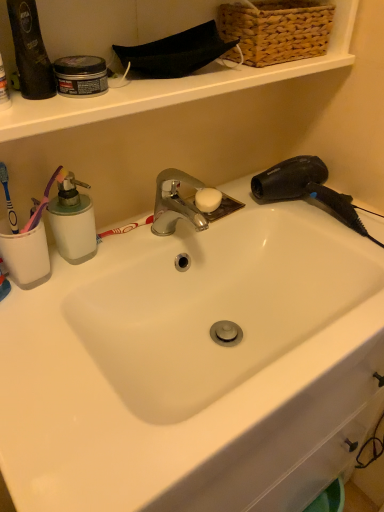
The image size is (384, 512). Identify the location of vacant space to the right of blue plastic toothbrush at left. (99, 248).